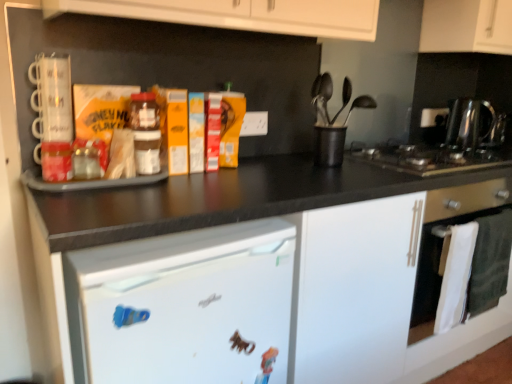
Where is `polished stainless steel kettle at right`? The height and width of the screenshot is (384, 512). polished stainless steel kettle at right is located at coordinates [x=467, y=123].

Describe the element at coordinates (146, 132) in the screenshot. I see `translucent plastic jar at center` at that location.

Describe the element at coordinates (466, 26) in the screenshot. I see `white matte cabinet at upper right` at that location.

Locate an element on the screen. This screenshot has height=384, width=512. black stainless steel gas stove at right is located at coordinates (431, 159).

Describe the element at coordinates (329, 145) in the screenshot. I see `black plastic utensil holder at center` at that location.

Find the location of a particular element. This screenshot has width=512, height=384. polished stainless steel kettle at right is located at coordinates (467, 123).

Looking at this image, can you confirm if white matte cabinet at upper right is taller than polished stainless steel kettle at right?

Yes, white matte cabinet at upper right is taller than polished stainless steel kettle at right.

Which point is more distant from viewer, (505,41) or (462,113)?

The point (462,113) is farther.

From the image's perspective, which object appears higher, white matte cabinet at upper right or polished stainless steel kettle at right?

white matte cabinet at upper right is shown above in the image.

Is white matte cabinet at upper right oriented away from polished stainless steel kettle at right?

white matte cabinet at upper right does not have its back to polished stainless steel kettle at right.

From the image's perspective, which one is positioned lower, translucent plastic jar at center or white matte cabinet at upper right?

translucent plastic jar at center, from the image's perspective.

Measure the distance from translucent plastic jar at center to white matte cabinet at upper right.

A distance of 1.45 meters exists between translucent plastic jar at center and white matte cabinet at upper right.

Can you tell me how much translucent plastic jar at center and white matte cabinet at upper right differ in facing direction?

There is a 0.00013-degree angle between the facing directions of translucent plastic jar at center and white matte cabinet at upper right.

Looking at this image, considering the sizes of objects translucent plastic jar at center and white matte cabinet at upper right in the image provided, who is bigger, translucent plastic jar at center or white matte cabinet at upper right?

white matte cabinet at upper right is bigger.

From the image's perspective, which is above, black stainless steel gas stove at right or white matte refrigerator at lower left?

black stainless steel gas stove at right is shown above in the image.

Is the position of black stainless steel gas stove at right less distant than that of white matte refrigerator at lower left?

No, the depth of black stainless steel gas stove at right is greater than that of white matte refrigerator at lower left.

Between black stainless steel gas stove at right and white matte refrigerator at lower left, which one has larger size?

With larger size is white matte refrigerator at lower left.

Which is closer, (402,164) or (183,277)?

Point (402,164) is positioned farther from the camera compared to point (183,277).

Which is more to the right, black plastic utensil holder at center or white matte cabinet at upper right?

white matte cabinet at upper right.

How different are the orientations of black plastic utensil holder at center and white matte cabinet at upper right in degrees?

The angle between the facing direction of black plastic utensil holder at center and the facing direction of white matte cabinet at upper right is 0.000587 degrees.

Considering the points (322, 129) and (439, 39), which point is in front, point (322, 129) or point (439, 39)?

Point (322, 129)

Looking at this image, which of these two, black plastic utensil holder at center or white matte cabinet at upper right, is bigger?

white matte cabinet at upper right.

Who is shorter, white matte cabinet at upper right or black stainless steel gas stove at right?

black stainless steel gas stove at right is shorter.

Is point (476, 41) closer or farther from the camera than point (503, 157)?

Point (476, 41) is farther from the camera than point (503, 157).

Does white matte cabinet at upper right have a larger size compared to black stainless steel gas stove at right?

Indeed, white matte cabinet at upper right has a larger size compared to black stainless steel gas stove at right.

Between white glossy oven at lower right and polished stainless steel kettle at right, which one has less height?

polished stainless steel kettle at right.

The image size is (512, 384). What are the coordinates of `kitchen appliance above the white glossy oven at lower right (from the image's perspective)` in the screenshot? It's located at (467, 123).

From a real-world perspective, between white glossy oven at lower right and polished stainless steel kettle at right, who is vertically higher?

From a 3D spatial view, polished stainless steel kettle at right is above.

Can you confirm if translucent plastic jar at center is bigger than black plastic utensil holder at center?

Actually, translucent plastic jar at center might be smaller than black plastic utensil holder at center.

In the image, there is a translucent plastic jar at center. Identify the location of appliance above it (from the image's perspective). (329, 145).

Considering the relative sizes of translucent plastic jar at center and black plastic utensil holder at center in the image provided, is translucent plastic jar at center shorter than black plastic utensil holder at center?

Yes.

Considering the points (147, 152) and (315, 164), which point is behind, point (147, 152) or point (315, 164)?

The point (315, 164) is more distant.

Locate an element on the screen. The width and height of the screenshot is (512, 384). cabinetry above the polished stainless steel kettle at right (from the image's perspective) is located at coordinates (466, 26).

Where is `cabinetry above the translucent plastic jar at center (from a real-world perspective)`? Image resolution: width=512 pixels, height=384 pixels. cabinetry above the translucent plastic jar at center (from a real-world perspective) is located at coordinates (466, 26).

Looking at the image, which one is located closer to translucent plastic jar at center, white matte cabinet at upper right or black stainless steel gas stove at right?

The object closer to translucent plastic jar at center is black stainless steel gas stove at right.

Based on their spatial positions, is white matte refrigerator at lower left or black plastic utensil holder at center closer to polished stainless steel kettle at right?

black plastic utensil holder at center is positioned closer to the anchor polished stainless steel kettle at right.

When comparing their distances from white glossy oven at lower right, does white matte cabinet at upper right or polished stainless steel kettle at right seem closer?

polished stainless steel kettle at right is positioned closer to the anchor white glossy oven at lower right.

Looking at the image, which one is located further to white matte refrigerator at lower left, black plastic utensil holder at center or translucent plastic jar at center?

The object further to white matte refrigerator at lower left is black plastic utensil holder at center.

Looking at the image, which one is located further to white glossy oven at lower right, black plastic utensil holder at center or white matte refrigerator at lower left?

white matte refrigerator at lower left is further to white glossy oven at lower right.

When comparing their distances from black plastic utensil holder at center, does white matte cabinet at upper right or white matte refrigerator at lower left seem further?

white matte cabinet at upper right.

Which object lies further to the anchor point white matte refrigerator at lower left, black plastic utensil holder at center or white matte cabinet at upper right?

white matte cabinet at upper right.

From the image, which object appears to be farther from polished stainless steel kettle at right, translucent plastic jar at center or white matte cabinet at upper right?

translucent plastic jar at center is positioned further to the anchor polished stainless steel kettle at right.

The width and height of the screenshot is (512, 384). In order to click on appliance located between translucent plastic jar at center and polished stainless steel kettle at right in the left-right direction in this screenshot , I will do `click(329, 145)`.

In order to click on gas stove situated between translucent plastic jar at center and white matte cabinet at upper right from left to right in this screenshot , I will do `click(431, 159)`.

In order to click on bottle located between white matte refrigerator at lower left and white matte cabinet at upper right in the left-right direction in this screenshot , I will do `click(146, 132)`.

Find the location of a particular element. Image resolution: width=512 pixels, height=384 pixels. appliance situated between white matte refrigerator at lower left and white glossy oven at lower right from left to right is located at coordinates (329, 145).